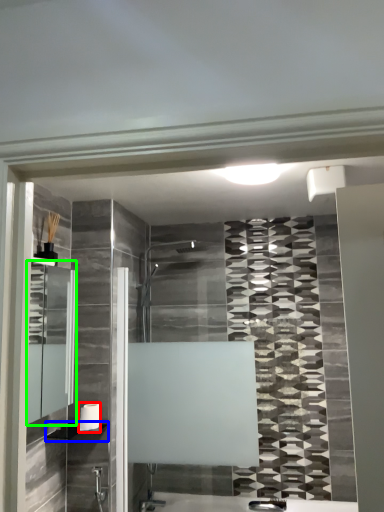
Question: Which object is the closest to the towel bar (highlighted by a red box)? Choose among these: shelf (highlighted by a blue box) or medicine cabinet (highlighted by a green box).

Choices:
 (A) shelf
 (B) medicine cabinet

Answer: (A)